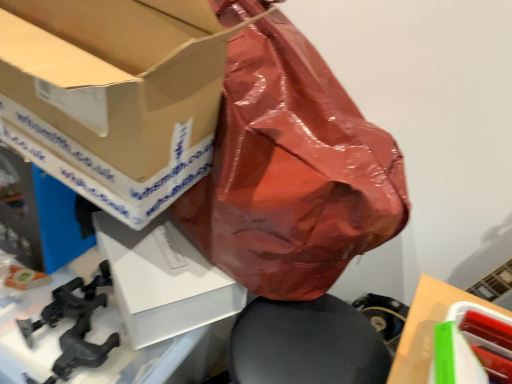
You are a GUI agent. You are given a task and a screenshot of the screen. Output one action in this format:
    pyautogui.click(x=<x>, y=<y>)
    Task: Click on the matte cardboard box at upper left, which is the third box from right to left
    This screenshot has height=384, width=512.
    Given the screenshot: What is the action you would take?
    pyautogui.click(x=114, y=95)

Describe the element at coordinates (163, 280) in the screenshot. The image size is (512, 384). I see `white matte box at center, arranged as the second box when viewed from the left` at that location.

Where is `white matte box at center, the second box from the right`? white matte box at center, the second box from the right is located at coordinates (163, 280).

Where is `black matte clamp at lower left`? black matte clamp at lower left is located at coordinates (75, 324).

Find the location of a particular element. white matte cardboard box at lower right is located at coordinates (426, 328).

Which is behind, point (149, 302) or point (419, 383)?

The point (149, 302) is farther.

Are white matte box at center, the second box from the right, and white matte cardboard box at lower right far apart?

No, there isn't a large distance between white matte box at center, the second box from the right, and white matte cardboard box at lower right.

Consider the image. Would you say white matte box at center, arranged as the second box when viewed from the left, is outside white matte cardboard box at lower right?

Indeed, white matte box at center, arranged as the second box when viewed from the left, is completely outside white matte cardboard box at lower right.

Is white matte box at center, arranged as the second box when viewed from the left, at the right side of white matte cardboard box at lower right?

In fact, white matte box at center, arranged as the second box when viewed from the left, is to the left of white matte cardboard box at lower right.

Looking at this image, would you consider black matte clamp at lower left to be distant from green plastic container at lower right, which appears as the 1th box when viewed from the right?

black matte clamp at lower left is near green plastic container at lower right, which appears as the 1th box when viewed from the right, not far away.

In the scene shown: Is black matte clamp at lower left oriented towards green plastic container at lower right, arranged as the 3th box when viewed from the left?

No, black matte clamp at lower left is not facing towards green plastic container at lower right, arranged as the 3th box when viewed from the left.

How many degrees apart are the facing directions of black matte clamp at lower left and green plastic container at lower right, arranged as the 3th box when viewed from the left?

88.1 degrees.

How much distance is there between green plastic container at lower right, which appears as the 1th box when viewed from the right, and matte cardboard box at upper left, acting as the first box starting from the left?

A distance of 23.30 inches exists between green plastic container at lower right, which appears as the 1th box when viewed from the right, and matte cardboard box at upper left, acting as the first box starting from the left.

Is green plastic container at lower right, arranged as the 3th box when viewed from the left, to the right of matte cardboard box at upper left, acting as the first box starting from the left, from the viewer's perspective?

Indeed, green plastic container at lower right, arranged as the 3th box when viewed from the left, is positioned on the right side of matte cardboard box at upper left, acting as the first box starting from the left.

Which is behind, point (437, 347) or point (203, 15)?

The point (203, 15) is farther from the camera.

Is green plastic container at lower right, arranged as the 3th box when viewed from the left, shorter than matte cardboard box at upper left, which is the third box from right to left?

Yes.

Considering the positions of points (122, 11) and (213, 301), is point (122, 11) farther from camera compared to point (213, 301)?

No, it is in front of (213, 301).

How different are the orientations of matte cardboard box at upper left, acting as the first box starting from the left, and white matte box at center, arranged as the second box when viewed from the left, in degrees?

25.7 degrees.

From the image's perspective, between matte cardboard box at upper left, acting as the first box starting from the left, and white matte box at center, arranged as the second box when viewed from the left, who is located below?

white matte box at center, arranged as the second box when viewed from the left, from the image's perspective.

Does matte cardboard box at upper left, acting as the first box starting from the left, come in front of white matte box at center, the second box from the right?

Yes, matte cardboard box at upper left, acting as the first box starting from the left, is in front of white matte box at center, the second box from the right.

From a real-world perspective, is white matte cardboard box at lower right physically above green plastic container at lower right, which appears as the 1th box when viewed from the right?

Yes, from a real-world perspective, white matte cardboard box at lower right is on top of green plastic container at lower right, which appears as the 1th box when viewed from the right.

In the scene shown: Could you tell me if white matte cardboard box at lower right is turned towards green plastic container at lower right, arranged as the 3th box when viewed from the left?

No, white matte cardboard box at lower right is not aimed at green plastic container at lower right, arranged as the 3th box when viewed from the left.

Is white matte cardboard box at lower right beside green plastic container at lower right, arranged as the 3th box when viewed from the left?

Yes, white matte cardboard box at lower right is right next to green plastic container at lower right, arranged as the 3th box when viewed from the left, and making contact.

From the image's perspective, is white matte cardboard box at lower right under green plastic container at lower right, arranged as the 3th box when viewed from the left?

Yes, from the image's perspective, white matte cardboard box at lower right is below green plastic container at lower right, arranged as the 3th box when viewed from the left.

Is point (49, 324) less distant than point (193, 6)?

No, (49, 324) is further to viewer.

Is black matte clamp at lower left oriented towards matte cardboard box at upper left, acting as the first box starting from the left?

No, black matte clamp at lower left is not facing towards matte cardboard box at upper left, acting as the first box starting from the left.

There is a black matte clamp at lower left. Where is `the 2nd box above it (from the image's perspective)`? The width and height of the screenshot is (512, 384). the 2nd box above it (from the image's perspective) is located at coordinates (114, 95).

What's the angular difference between black matte clamp at lower left and matte cardboard box at upper left, which is the third box from right to left,'s facing directions?

The angular difference between black matte clamp at lower left and matte cardboard box at upper left, which is the third box from right to left, is 92.3 degrees.

From a real-world perspective, is white matte box at center, the second box from the right, physically above black matte clamp at lower left?

Correct, in the physical world, white matte box at center, the second box from the right, is higher than black matte clamp at lower left.

Is white matte box at center, the second box from the right, directly adjacent to black matte clamp at lower left?

No, white matte box at center, the second box from the right, is not making contact with black matte clamp at lower left.

Which of these two, white matte box at center, arranged as the second box when viewed from the left, or black matte clamp at lower left, is thinner?

Thinner between the two is black matte clamp at lower left.

From the image's perspective, count 1st boxs upward from the black matte clamp at lower left and point to it. Please provide its 2D coordinates.

[(163, 280)]

Image resolution: width=512 pixels, height=384 pixels. I want to click on cardboard box in front of the white matte box at center, the second box from the right, so coord(426,328).

You are a GUI agent. You are given a task and a screenshot of the screen. Output one action in this format:
    pyautogui.click(x=<x>, y=<y>)
    Task: Click on the box below the black matte clamp at lower left (from the image's perspective)
    The image size is (512, 384).
    Given the screenshot: What is the action you would take?
    pyautogui.click(x=472, y=347)

Looking at the image, which one is located closer to matte cardboard box at upper left, which is the third box from right to left, green plastic container at lower right, arranged as the 3th box when viewed from the left, or white matte box at center, arranged as the second box when viewed from the left?

Based on the image, white matte box at center, arranged as the second box when viewed from the left, appears to be nearer to matte cardboard box at upper left, which is the third box from right to left.

Consider the image. Estimate the real-world distances between objects in this image. Which object is further from white matte box at center, arranged as the second box when viewed from the left, matte cardboard box at upper left, acting as the first box starting from the left, or black matte clamp at lower left?

Based on the image, matte cardboard box at upper left, acting as the first box starting from the left, appears to be further to white matte box at center, arranged as the second box when viewed from the left.

Based on the photo, considering their positions, is green plastic container at lower right, which appears as the 1th box when viewed from the right, positioned closer to white matte box at center, the second box from the right, than white matte cardboard box at lower right?

white matte cardboard box at lower right is closer to white matte box at center, the second box from the right.

From the image, which object appears to be nearer to white matte cardboard box at lower right, black matte clamp at lower left or matte cardboard box at upper left, which is the third box from right to left?

black matte clamp at lower left.

Based on their spatial positions, is white matte cardboard box at lower right or matte cardboard box at upper left, which is the third box from right to left, further from black matte clamp at lower left?

white matte cardboard box at lower right.

When comparing their distances from green plastic container at lower right, arranged as the 3th box when viewed from the left, does white matte cardboard box at lower right or matte cardboard box at upper left, which is the third box from right to left, seem closer?

white matte cardboard box at lower right is positioned closer to the anchor green plastic container at lower right, arranged as the 3th box when viewed from the left.

In the scene shown: Which object lies further to the anchor point white matte box at center, arranged as the second box when viewed from the left, white matte cardboard box at lower right or matte cardboard box at upper left, which is the third box from right to left?

white matte cardboard box at lower right is positioned further to the anchor white matte box at center, arranged as the second box when viewed from the left.

Based on their spatial positions, is white matte box at center, arranged as the second box when viewed from the left, or white matte cardboard box at lower right further from matte cardboard box at upper left, which is the third box from right to left?

white matte cardboard box at lower right lies further to matte cardboard box at upper left, which is the third box from right to left, than the other object.

Identify the location of box located between black matte clamp at lower left and green plastic container at lower right, arranged as the 3th box when viewed from the left, in the left-right direction. (163, 280).

Where is `weapon situated between matte cardboard box at upper left, which is the third box from right to left, and white matte cardboard box at lower right from left to right`? weapon situated between matte cardboard box at upper left, which is the third box from right to left, and white matte cardboard box at lower right from left to right is located at coordinates (75, 324).

This screenshot has width=512, height=384. In order to click on box between black matte clamp at lower left and white matte cardboard box at lower right in the horizontal direction in this screenshot , I will do `click(163, 280)`.

At what (x,y) coordinates should I click in order to perform the action: click on weapon between matte cardboard box at upper left, acting as the first box starting from the left, and green plastic container at lower right, arranged as the 3th box when viewed from the left, in the horizontal direction. Please return your answer as a coordinate pair (x, y). The height and width of the screenshot is (384, 512). Looking at the image, I should click on (75, 324).